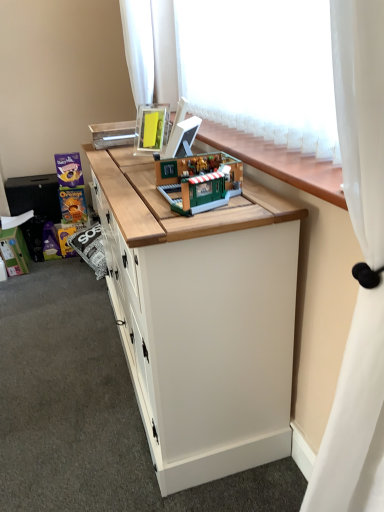
What do you see at coordinates (360, 267) in the screenshot? The width and height of the screenshot is (384, 512). I see `white sheer curtain at upper right, positioned as the 2th curtain in left-to-right order` at bounding box center [360, 267].

Find the location of a particular element. white sheer curtain at upper right, acting as the 1th curtain starting from the right is located at coordinates (360, 267).

How much space does white sheer curtain at upper center, acting as the 2th curtain starting from the right, occupy horizontally?

It is 6.64 inches.

What is the approximate height of white sheer curtain at upper center, the first curtain viewed from the back?

white sheer curtain at upper center, the first curtain viewed from the back, is 61.15 centimeters in height.

What do you see at coordinates (277, 161) in the screenshot?
I see `wooden counter top at center` at bounding box center [277, 161].

Image resolution: width=384 pixels, height=512 pixels. Describe the element at coordinates (202, 319) in the screenshot. I see `white matte cabinet at center` at that location.

At what (x,y) coordinates should I click in order to perform the action: click on brick-like green building at center, the third toy from the back. Please return your answer as a coordinate pair (x, y). Image resolution: width=384 pixels, height=512 pixels. Looking at the image, I should click on (198, 181).

Looking at this image, is wooden counter top at center facing away from brick-like green building at center, the first toy in the right-to-left sequence?

Yes, brick-like green building at center, the first toy in the right-to-left sequence, is at the back of wooden counter top at center.

Which point is more forward, [239,152] or [216,176]?

The point [216,176] is closer to the camera.

From the image's perspective, does wooden counter top at center appear lower than brick-like green building at center, which appears as the first toy when viewed from the front?

No, from the image's perspective, wooden counter top at center is not below brick-like green building at center, which appears as the first toy when viewed from the front.

Consider the image. Considering the sizes of objects wooden counter top at center and brick-like green building at center, the first toy in the right-to-left sequence, in the image provided, who is shorter, wooden counter top at center or brick-like green building at center, the first toy in the right-to-left sequence,?

wooden counter top at center.

Which object is further away from the camera, matte orange cereal box at left, which appears as the 1th toy when viewed from the left, or white matte cabinet at center?

matte orange cereal box at left, which appears as the 1th toy when viewed from the left, is further from the camera.

Between matte orange cereal box at left, which appears as the 1th toy when viewed from the left, and white matte cabinet at center, which one has smaller width?

matte orange cereal box at left, which appears as the 1th toy when viewed from the left.

Could you tell me if matte orange cereal box at left, acting as the third toy starting from the right, is turned towards white matte cabinet at center?

Yes, matte orange cereal box at left, acting as the third toy starting from the right, is facing white matte cabinet at center.

From the image's perspective, which object appears higher, wooden counter top at center or white matte cabinet at center?

From the image's view, wooden counter top at center is above.

Which point is more forward, [276,165] or [217,259]?

Positioned in front is point [217,259].

The width and height of the screenshot is (384, 512). What are the coordinates of `cabinetry lying below the wooden counter top at center (from the image's perspective)` in the screenshot? It's located at (202, 319).

Considering the positions of objects wooden counter top at center and white matte cabinet at center in the image provided, who is behind, wooden counter top at center or white matte cabinet at center?

white matte cabinet at center is more distant.

From a real-world perspective, who is located higher, brick-like green building at center, the third toy from the back, or white matte cabinet at center?

In real-world perspective, brick-like green building at center, the third toy from the back, is above.

Does brick-like green building at center, the first toy in the right-to-left sequence, lie behind white matte cabinet at center?

Yes, it is behind white matte cabinet at center.

From the image's perspective, would you say brick-like green building at center, which appears as the first toy when viewed from the front, is shown under white matte cabinet at center?

Incorrect, from the image's perspective, brick-like green building at center, which appears as the first toy when viewed from the front, is higher than white matte cabinet at center.

This screenshot has width=384, height=512. Find the location of `counter top lying on the left of white sheer curtain at upper right, placed as the 2th curtain when sorted from top to bottom`. counter top lying on the left of white sheer curtain at upper right, placed as the 2th curtain when sorted from top to bottom is located at coordinates (277, 161).

Could you measure the distance between white sheer curtain at upper right, positioned as the 2th curtain in left-to-right order, and wooden counter top at center?

20.18 inches.

Is white sheer curtain at upper right, the 2th curtain from the back, looking in the opposite direction of wooden counter top at center?

white sheer curtain at upper right, the 2th curtain from the back, is not turned away from wooden counter top at center.

Does white sheer curtain at upper right, positioned as the 2th curtain in left-to-right order, contain wooden counter top at center?

No, wooden counter top at center is not a part of white sheer curtain at upper right, positioned as the 2th curtain in left-to-right order.

From the picture: Is matte purple chocolate bar at left, the second toy from the left, not inside white matte cabinet at center?

matte purple chocolate bar at left, the second toy from the left, lies outside white matte cabinet at center's area.

From a real-world perspective, is matte purple chocolate bar at left, the second toy from the left, beneath white matte cabinet at center?

Actually, matte purple chocolate bar at left, the second toy from the left, is physically above white matte cabinet at center in the real world.

Is matte purple chocolate bar at left, the second toy from the left, wider or thinner than white matte cabinet at center?

matte purple chocolate bar at left, the second toy from the left, is thinner than white matte cabinet at center.

Is matte purple chocolate bar at left, which ranks as the second toy in front-to-back order, to the left or to the right of white matte cabinet at center in the image?

From the image, it's evident that matte purple chocolate bar at left, which ranks as the second toy in front-to-back order, is to the left of white matte cabinet at center.

How far apart are matte orange cereal box at left, which appears as the 1th toy when viewed from the left, and white sheer curtain at upper right, which is the 1th curtain from front to back?

2.33 meters.

From a real-world perspective, is matte orange cereal box at left, acting as the third toy starting from the right, over white sheer curtain at upper right, acting as the 1th curtain starting from the right?

Actually, matte orange cereal box at left, acting as the third toy starting from the right, is physically below white sheer curtain at upper right, acting as the 1th curtain starting from the right, in the real world.

From the image's perspective, does matte orange cereal box at left, which appears as the first toy when viewed from the back, appear lower than white sheer curtain at upper right, the 2th curtain from the back?

No, from the image's perspective, matte orange cereal box at left, which appears as the first toy when viewed from the back, is not beneath white sheer curtain at upper right, the 2th curtain from the back.

I want to click on curtain below the matte orange cereal box at left, which appears as the 1th toy when viewed from the left (from the image's perspective), so click(360, 267).

Image resolution: width=384 pixels, height=512 pixels. In order to click on the 1st toy counting from the left of the wooden counter top at center in this screenshot , I will do `click(198, 181)`.

The width and height of the screenshot is (384, 512). Find the location of `cabinetry located on the right of matte orange cereal box at left, the 3th toy from the front`. cabinetry located on the right of matte orange cereal box at left, the 3th toy from the front is located at coordinates (202, 319).

When comparing their distances from wooden counter top at center, does matte purple chocolate bar at left, which ranks as the second toy in front-to-back order, or white sheer curtain at upper center, the first curtain viewed from the back, seem closer?

Among the two, white sheer curtain at upper center, the first curtain viewed from the back, is located nearer to wooden counter top at center.

From the image, which object appears to be farther from matte orange cereal box at left, which appears as the first toy when viewed from the back, white matte cabinet at center or white sheer curtain at upper right, acting as the 1th curtain starting from the right?

white sheer curtain at upper right, acting as the 1th curtain starting from the right, is positioned further to the anchor matte orange cereal box at left, which appears as the first toy when viewed from the back.

When comparing their distances from matte orange cereal box at left, acting as the third toy starting from the right, does wooden counter top at center or white sheer curtain at upper right, placed as the 2th curtain when sorted from top to bottom, seem closer?

wooden counter top at center is closer to matte orange cereal box at left, acting as the third toy starting from the right.

Which object lies nearer to the anchor point white sheer curtain at upper right, which ranks as the 1th curtain in bottom-to-top order, wooden counter top at center or matte orange cereal box at left, which appears as the first toy when viewed from the back?

wooden counter top at center.

Considering their positions, is white matte cabinet at center positioned further to matte purple chocolate bar at left, which ranks as the second toy in front-to-back order, than matte orange cereal box at left, which appears as the first toy when viewed from the back?

white matte cabinet at center lies further to matte purple chocolate bar at left, which ranks as the second toy in front-to-back order, than the other object.

Based on their spatial positions, is white sheer curtain at upper right, placed as the 2th curtain when sorted from top to bottom, or brick-like green building at center, the first toy in the right-to-left sequence, closer to white matte cabinet at center?

brick-like green building at center, the first toy in the right-to-left sequence.

Based on their spatial positions, is matte purple chocolate bar at left, which ranks as the second toy in front-to-back order, or white matte cabinet at center closer to white sheer curtain at upper center, acting as the 2th curtain starting from the right?

Based on the image, matte purple chocolate bar at left, which ranks as the second toy in front-to-back order, appears to be nearer to white sheer curtain at upper center, acting as the 2th curtain starting from the right.

Based on their spatial positions, is matte orange cereal box at left, acting as the third toy starting from the right, or white sheer curtain at upper center, which is the first curtain in top-to-bottom order, further from matte purple chocolate bar at left, positioned as the 2th toy in back-to-front order?

white sheer curtain at upper center, which is the first curtain in top-to-bottom order, is further to matte purple chocolate bar at left, positioned as the 2th toy in back-to-front order.

Image resolution: width=384 pixels, height=512 pixels. In order to click on toy between brick-like green building at center, which is the third toy in left-to-right order, and matte orange cereal box at left, the 3th toy from the front, from front to back in this screenshot , I will do `click(69, 170)`.

Where is `toy between wooden counter top at center and white sheer curtain at upper center, arranged as the 2th curtain when viewed from the front, in the front-back direction`? toy between wooden counter top at center and white sheer curtain at upper center, arranged as the 2th curtain when viewed from the front, in the front-back direction is located at coordinates (198, 181).

The width and height of the screenshot is (384, 512). What are the coordinates of `curtain between brick-like green building at center, the first toy in the right-to-left sequence, and matte orange cereal box at left, which appears as the 1th toy when viewed from the left, from front to back` in the screenshot? It's located at (150, 50).

Image resolution: width=384 pixels, height=512 pixels. Find the location of `curtain between brick-like green building at center, which is the third toy in left-to-right order, and matte purple chocolate bar at left, positioned as the 2th toy in back-to-front order, in the front-back direction`. curtain between brick-like green building at center, which is the third toy in left-to-right order, and matte purple chocolate bar at left, positioned as the 2th toy in back-to-front order, in the front-back direction is located at coordinates (150, 50).